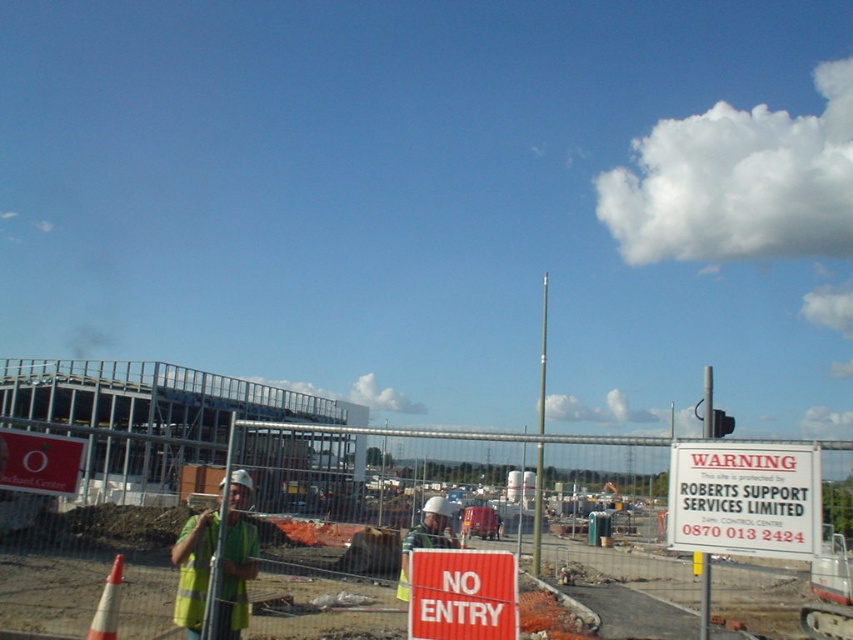
Question: Which point appears closest to the camera in this image?

Choices:
 (A) pyautogui.click(x=479, y=554)
 (B) pyautogui.click(x=68, y=458)
 (C) pyautogui.click(x=219, y=628)
 (D) pyautogui.click(x=650, y=561)

Answer: (A)

Question: Considering the relative positions of metal fence at center and white plastic sign at upper left in the image provided, where is metal fence at center located with respect to white plastic sign at upper left?

Choices:
 (A) left
 (B) right

Answer: (A)

Question: Among these objects, which one is nearest to the camera?

Choices:
 (A) reflective yellow vest at center
 (B) white paper sign at center right

Answer: (B)

Question: Which point is farther to the camera?

Choices:
 (A) metal fence at center
 (B) yellow reflective vest at center
 (C) red corrugated metal sign at center
 (D) white plastic sign at upper left

Answer: (B)

Question: Can you confirm if white paper sign at center right is positioned to the right of red corrugated metal sign at center?

Choices:
 (A) yes
 (B) no

Answer: (A)

Question: Is metal fence at center positioned before yellow reflective vest at center?

Choices:
 (A) no
 (B) yes

Answer: (B)